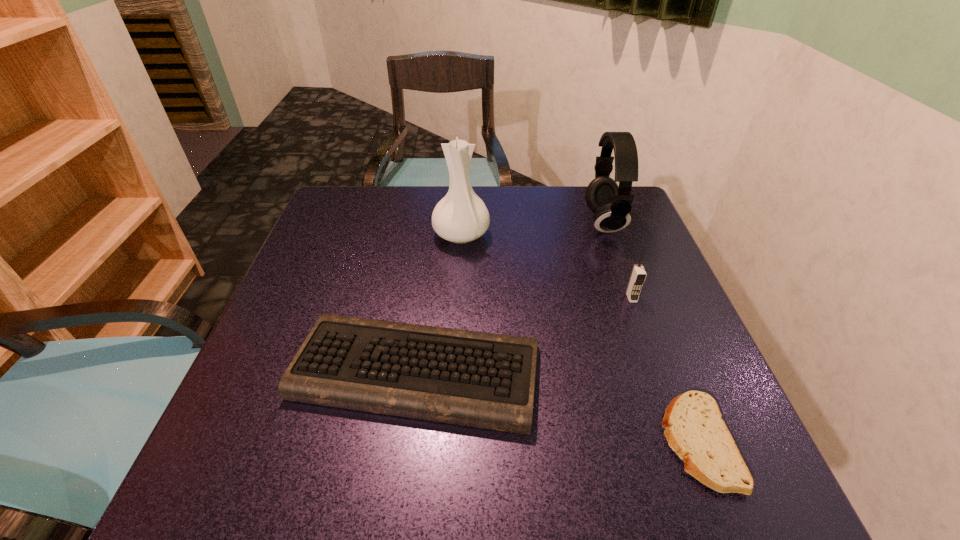
The height and width of the screenshot is (540, 960). Find the location of `free point located on the front-facing side of the third farthest object`. free point located on the front-facing side of the third farthest object is located at coordinates (691, 462).

This screenshot has height=540, width=960. What are the coordinates of `vacant region located 0.280m on the right of the second shortest object` in the screenshot? It's located at (691, 372).

Where is `free point located on the left of the pita bread`? The height and width of the screenshot is (540, 960). free point located on the left of the pita bread is located at coordinates (529, 443).

Locate an element on the screen. The image size is (960, 540). vase at the far edge is located at coordinates (461, 216).

The width and height of the screenshot is (960, 540). Identify the location of earphone at the far edge. (611, 204).

The height and width of the screenshot is (540, 960). Identify the location of object at the near edge. (695, 431).

Find the location of a particular element. object present at the left edge is located at coordinates (477, 379).

The width and height of the screenshot is (960, 540). Identify the location of earphone that is at the right edge. (611, 204).

The image size is (960, 540). Identify the location of cellular telephone situated at the right edge. (638, 275).

Where is `pita bread at the right edge`? This screenshot has height=540, width=960. pita bread at the right edge is located at coordinates (695, 431).